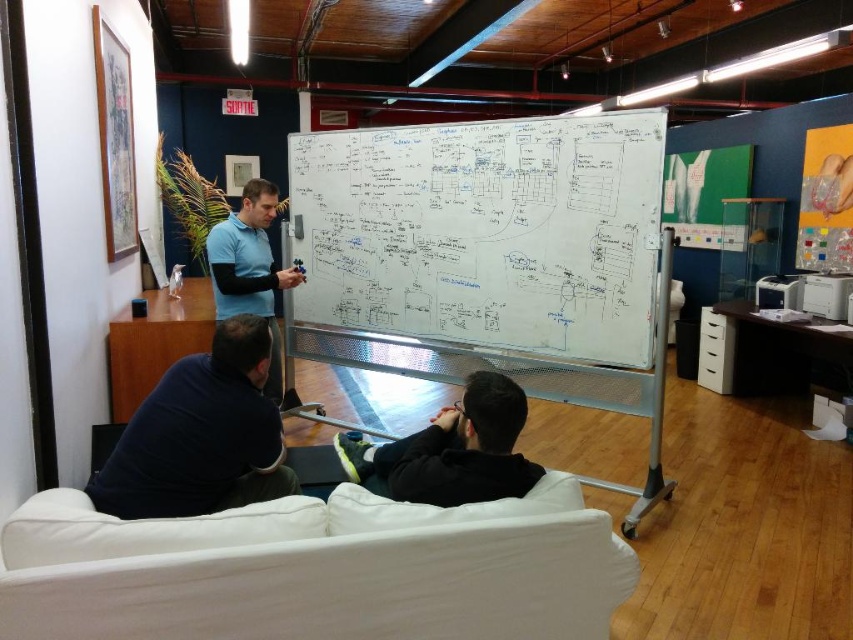
Can you confirm if dark blue fabric at lower left is wider than black matte jacket at lower center?

No.

Is dark blue fabric at lower left below black matte jacket at lower center?

Incorrect, dark blue fabric at lower left is not positioned below black matte jacket at lower center.

What do you see at coordinates (200, 435) in the screenshot?
I see `dark blue fabric at lower left` at bounding box center [200, 435].

Image resolution: width=853 pixels, height=640 pixels. In order to click on dark blue fabric at lower left in this screenshot , I will do `click(200, 435)`.

Does whiteboard at center have a greater width compared to dark blue fabric at lower left?

Yes.

Identify the location of whiteboard at center. (485, 232).

Where is `whiteboard at center`? This screenshot has width=853, height=640. whiteboard at center is located at coordinates (485, 232).

From the picture: Is dark blue fabric at lower left wider than blue cotton shirt at center?

Correct, the width of dark blue fabric at lower left exceeds that of blue cotton shirt at center.

Is dark blue fabric at lower left taller than blue cotton shirt at center?

Incorrect, dark blue fabric at lower left's height is not larger of blue cotton shirt at center's.

Is point (222, 445) less distant than point (288, 269)?

That is True.

You are a GUI agent. You are given a task and a screenshot of the screen. Output one action in this format:
    pyautogui.click(x=<x>, y=<y>)
    Task: Click on the dark blue fabric at lower left
    This screenshot has width=853, height=640.
    Given the screenshot: What is the action you would take?
    pyautogui.click(x=200, y=435)